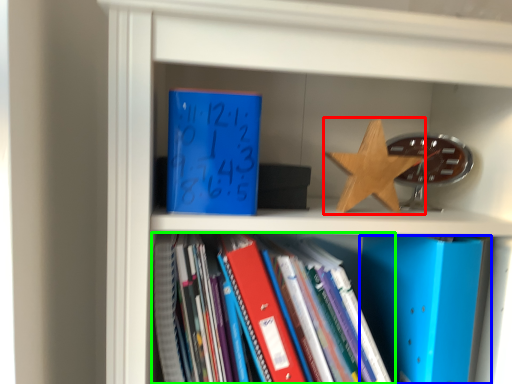
Question: Which is nearer to the star (highlighted by a red box)? paperback book (highlighted by a blue box) or book (highlighted by a green box).

Choices:
 (A) paperback book
 (B) book

Answer: (A)